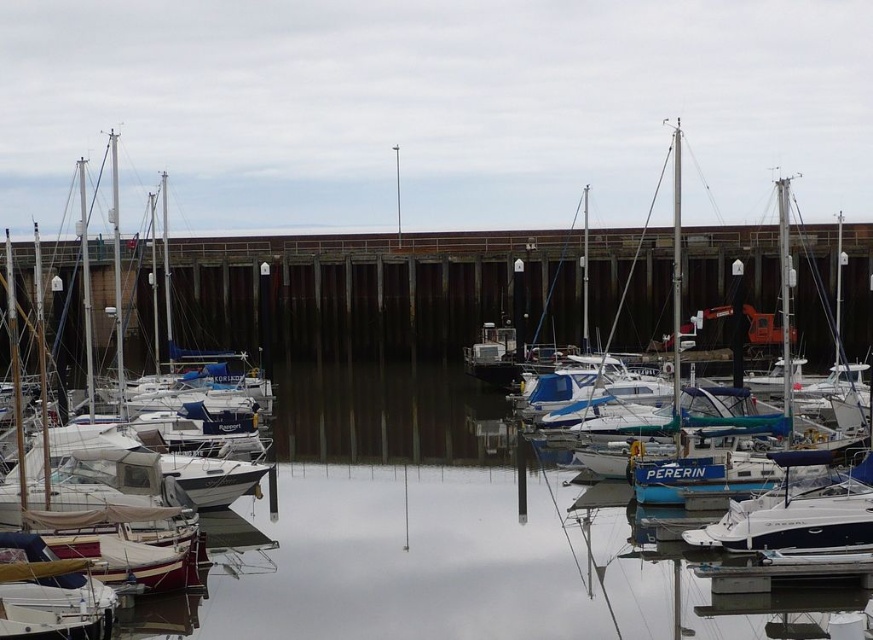
Is white matte sailboat at left smaller than blue glossy sailboat at center?

No.

Is white matte sailboat at left shorter than blue glossy sailboat at center?

Yes, white matte sailboat at left is shorter than blue glossy sailboat at center.

Which is in front, point (243, 545) or point (624, 289)?

Point (243, 545) is in front.

Locate an element on the screen. white matte sailboat at left is located at coordinates (221, 520).